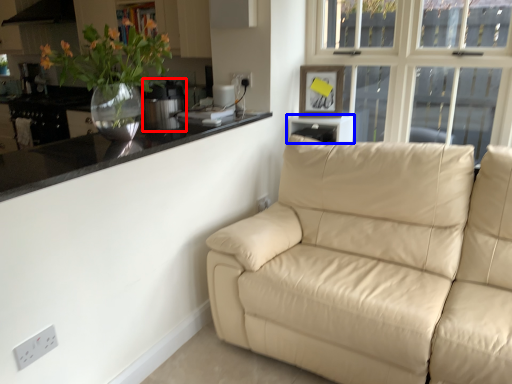
Question: Which of the following is the closest to the observer, appliance (highlighted by a red box) or window sill (highlighted by a blue box)?

Choices:
 (A) appliance
 (B) window sill

Answer: (A)